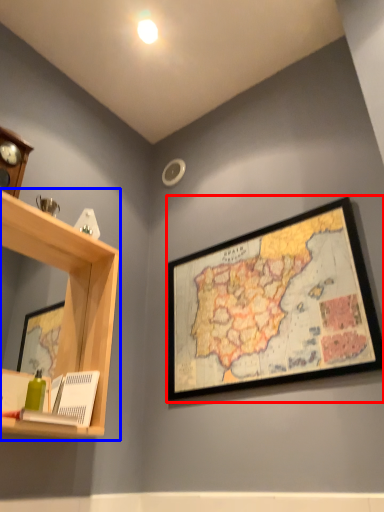
Question: Which object appears closest to the camera in this image, picture frame (highlighted by a red box) or shelf (highlighted by a blue box)?

Choices:
 (A) picture frame
 (B) shelf

Answer: (B)